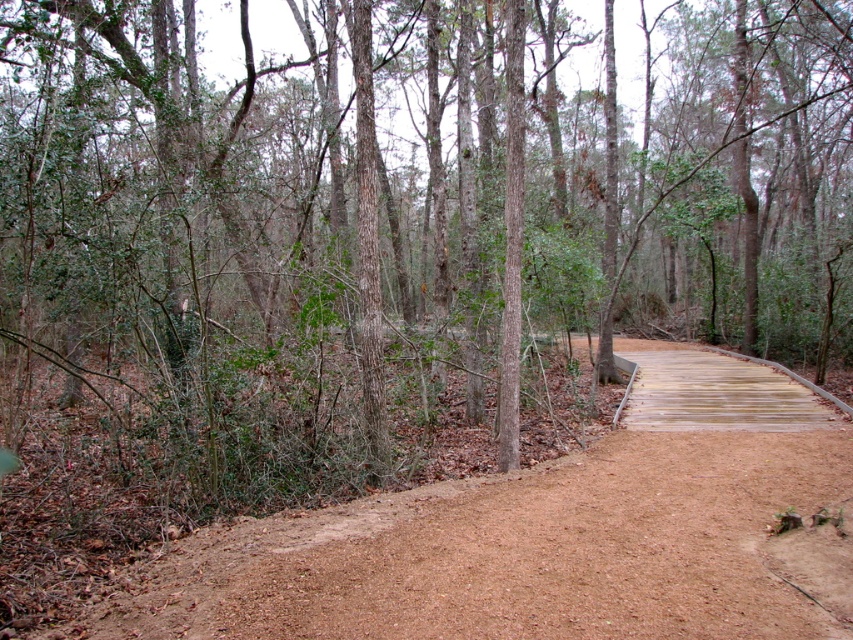
Is brown dirt track at lower center shorter than wooden boardwalk at center-right?

Yes, brown dirt track at lower center is shorter than wooden boardwalk at center-right.

How much distance is there between brown dirt track at lower center and wooden boardwalk at center-right?

brown dirt track at lower center and wooden boardwalk at center-right are 4.16 meters apart.

The image size is (853, 640). What do you see at coordinates (531, 552) in the screenshot? I see `brown dirt track at lower center` at bounding box center [531, 552].

Where is `brown dirt track at lower center`? The width and height of the screenshot is (853, 640). brown dirt track at lower center is located at coordinates (531, 552).